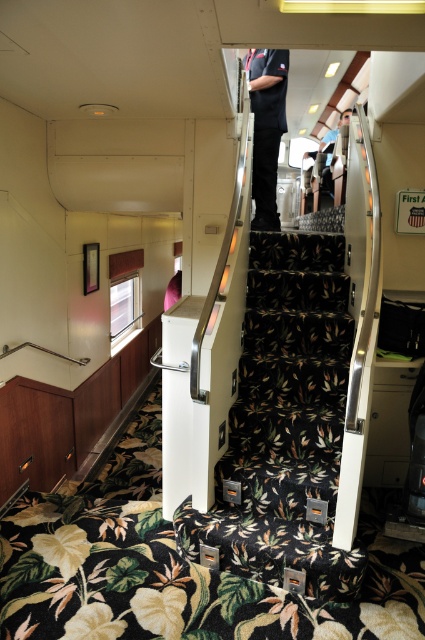
You are a passenger on the train and see the floral carpeted stairs at center and the dark blue uniform at center. Which object is positioned more to the left?

The floral carpeted stairs at center is to the left of dark blue uniform at center, so the floral carpeted stairs at center is positioned more to the left.

You are a passenger standing at the bottom of the staircase in the train car. You see the floral carpeted stairs at center and the dark blue uniform at center. Which object is positioned higher relative to the other?

The dark blue uniform at center is positioned higher than the floral carpeted stairs at center because it is located above it.